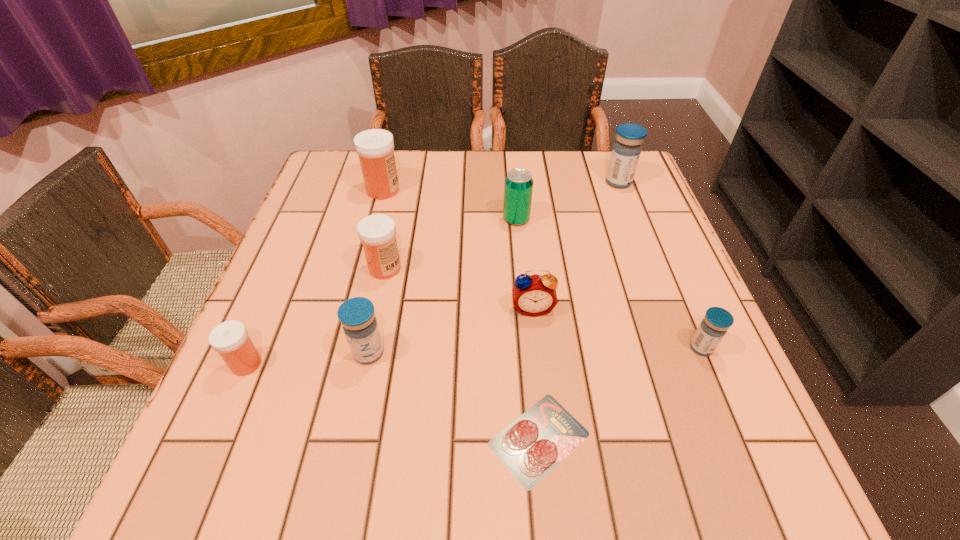
The height and width of the screenshot is (540, 960). What are the coordinates of `free space between the salami and the leftmost blue medicine` in the screenshot? It's located at (454, 396).

You are a GUI agent. You are given a task and a screenshot of the screen. Output one action in this format:
    pyautogui.click(x=<x>, y=<y>)
    Task: Click on the object that stands as the fifth closest to the nearest object
    This screenshot has width=960, height=540.
    Given the screenshot: What is the action you would take?
    coord(230,339)

Identify the location of object that is the nearest to the second farthest white medicine. The width and height of the screenshot is (960, 540). (357, 316).

Identify which medicine is located as the nearest to the biggest white medicine. Please provide its 2D coordinates. Your answer should be formatted as a tuple, i.e. [(x, y)], where the tuple contains the x and y coordinates of a point satisfying the conditions above.

[(377, 232)]

Identify the location of medicine that stands as the fifth closest to the nearest white medicine. The width and height of the screenshot is (960, 540). (626, 151).

Identify which blue medicine is the nearest to the teal beer can. Please provide its 2D coordinates. Your answer should be formatted as a tuple, i.e. [(x, y)], where the tuple contains the x and y coordinates of a point satisfying the conditions above.

[(626, 151)]

The width and height of the screenshot is (960, 540). Identify the location of blue medicine that is the second closest one to the nearest white medicine. (716, 322).

The height and width of the screenshot is (540, 960). Identify the location of the second closest white medicine to the nearest object. (230, 339).

Image resolution: width=960 pixels, height=540 pixels. I want to click on white medicine that is the second closest to the shortest object, so click(x=230, y=339).

Locate an element on the screen. This screenshot has width=960, height=540. vacant space that satisfies the following two spatial constraints: 1. on the front side of the smallest blue medicine; 2. on the left side of the seventh nearest object is located at coordinates point(528,348).